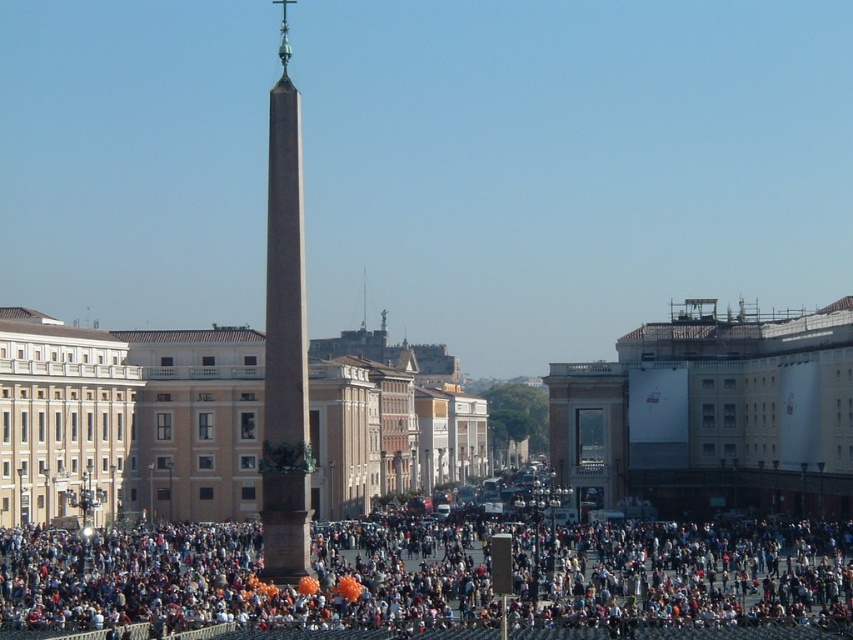
Can you confirm if multicolored fabric crowd at lower center is smaller than brown polished stone obelisk at center?

Indeed, multicolored fabric crowd at lower center has a smaller size compared to brown polished stone obelisk at center.

Who is more forward, (9, 580) or (271, 545)?

Point (271, 545) is in front.

At what (x,y) coordinates should I click in order to perform the action: click on multicolored fabric crowd at lower center. Please return your answer as a coordinate pair (x, y). This screenshot has width=853, height=640. Looking at the image, I should click on (436, 580).

Which is in front, point (276, 152) or point (364, 328)?

Point (276, 152) is more forward.

Can you confirm if brown polished stone obelisk at center is smaller than smooth stone spire at center?

No, brown polished stone obelisk at center is not smaller than smooth stone spire at center.

Does point (283, 417) come in front of point (364, 305)?

Yes, it is.

Identify the location of brown polished stone obelisk at center. This screenshot has height=640, width=853. (283, 340).

Which of these two, multicolored fabric crowd at lower center or smooth stone spire at center, stands taller?

smooth stone spire at center

Can you confirm if multicolored fabric crowd at lower center is taller than smooth stone spire at center?

Incorrect, multicolored fabric crowd at lower center's height is not larger of smooth stone spire at center's.

Which is in front, point (223, 598) or point (364, 275)?

Point (223, 598) is more forward.

This screenshot has height=640, width=853. I want to click on multicolored fabric crowd at lower center, so click(x=436, y=580).